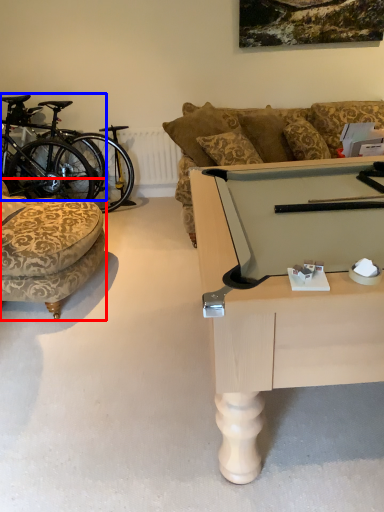
Question: Which object appears farthest to the camera in this image, chair (highlighted by a red box) or bicycle (highlighted by a blue box)?

Choices:
 (A) chair
 (B) bicycle

Answer: (B)